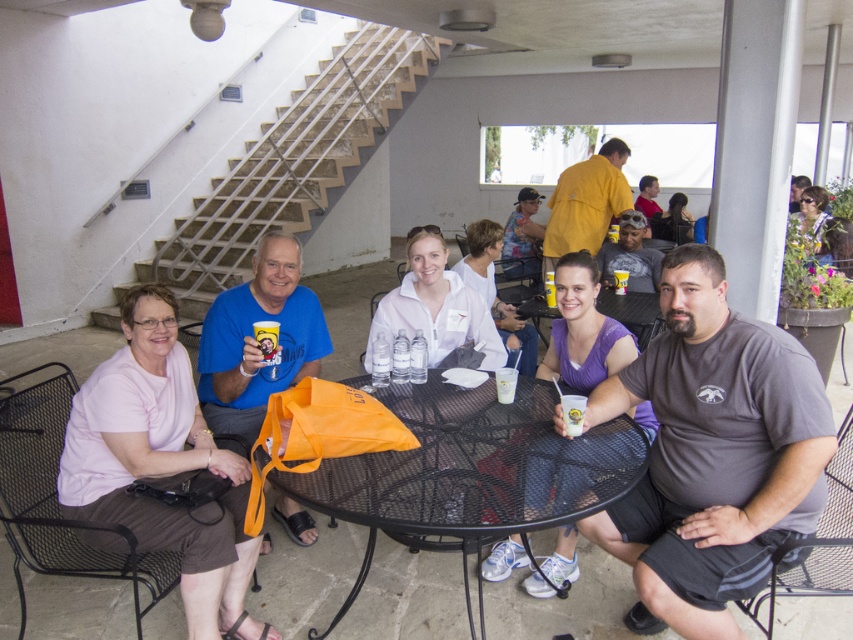
Question: Is black mesh table at center further to the viewer compared to pink fabric shirt at left?

Choices:
 (A) no
 (B) yes

Answer: (A)

Question: Which is farther from the black mesh table at center?

Choices:
 (A) metallic black table at center
 (B) orange fabric bag at center
 (C) translucent plastic cup at center

Answer: (C)

Question: Which is nearer to the orange fabric bag at center?

Choices:
 (A) black mesh table at center
 (B) translucent plastic cup at center

Answer: (A)

Question: Does gray cotton t-shirt at lower right come behind pink fabric shirt at left?

Choices:
 (A) no
 (B) yes

Answer: (A)

Question: Among these points, which one is nearest to the camera?

Choices:
 (A) (799, 460)
 (B) (543, 339)
 (C) (614, 285)

Answer: (A)

Question: Is black mesh table at center smaller than metallic black table at center?

Choices:
 (A) yes
 (B) no

Answer: (B)